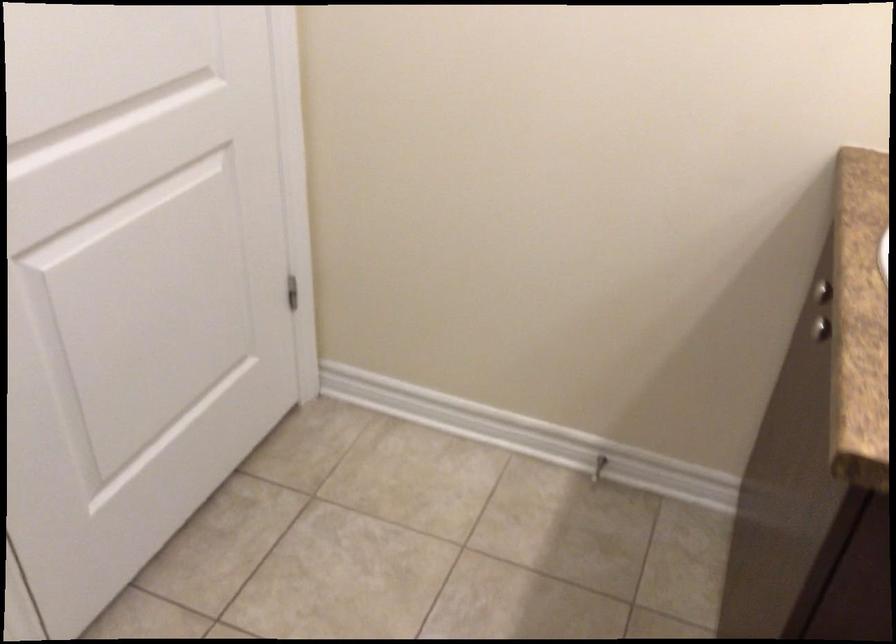
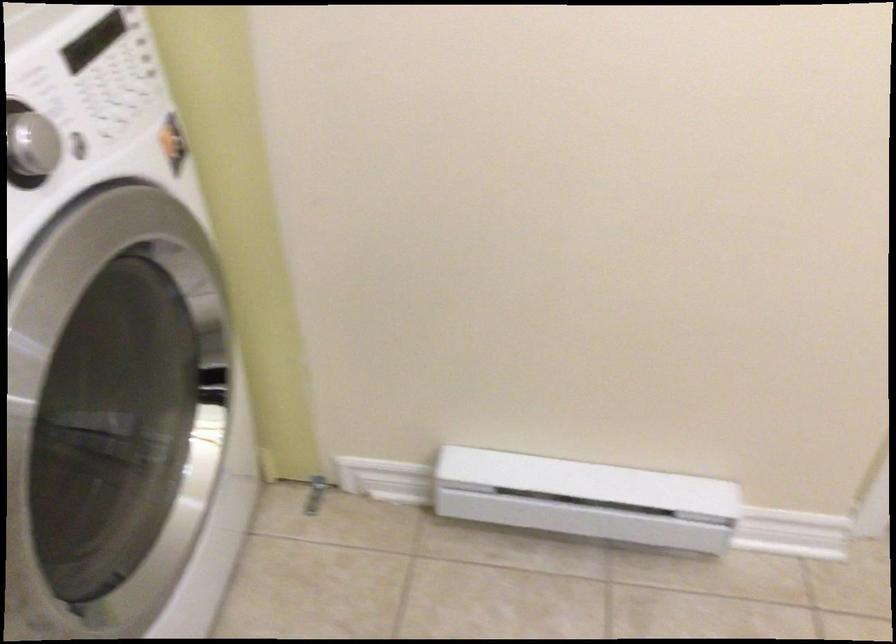
The first image is from the beginning of the video and the second image is from the end. How did the camera likely rotate when shooting the video?

The rotation direction of the camera is left-down.